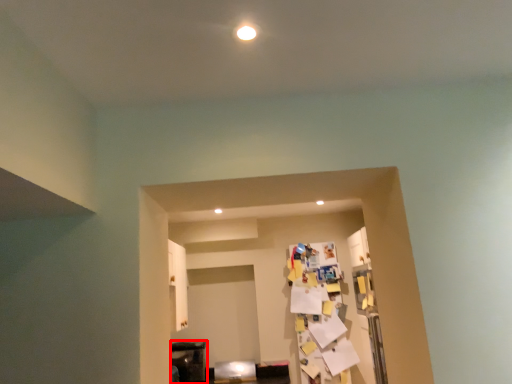
Question: In this image, where is furniture (annotated by the red box) located relative to furniture?

Choices:
 (A) right
 (B) left

Answer: (B)